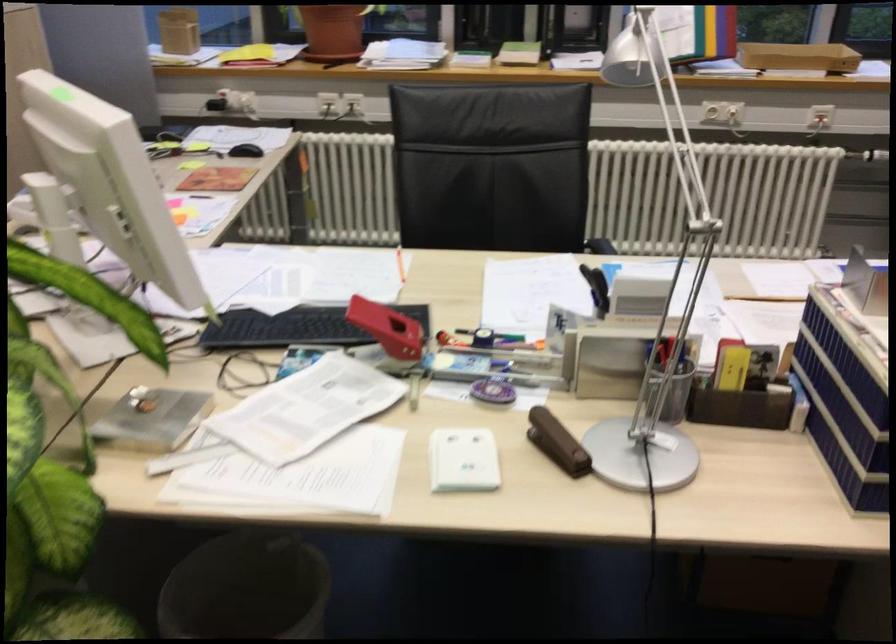
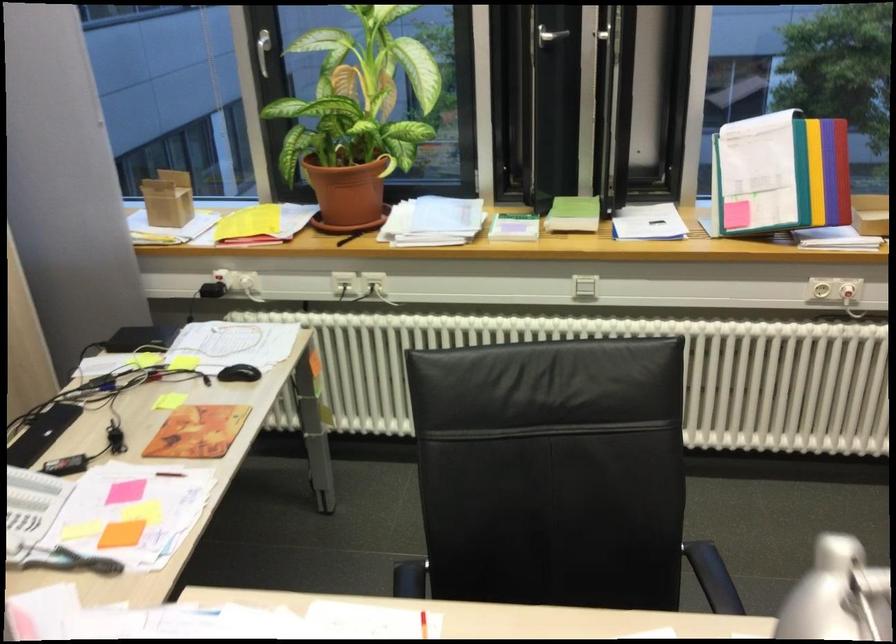
Question: The images are taken continuously from a first-person perspective. In which direction are you moving?

Choices:
 (A) Left
 (B) Right
 (C) Forward
 (D) Backward

Answer: (C)